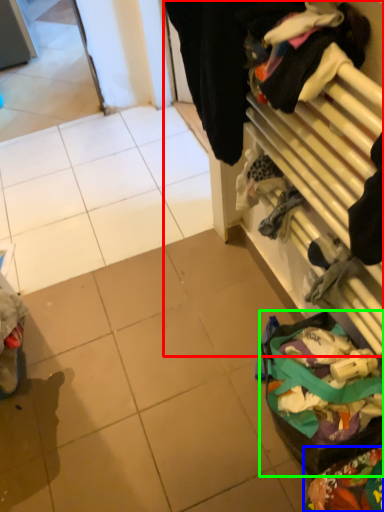
Question: Which object is positioned farthest from closet (highlighted by a red box)? Select from waste (highlighted by a blue box) and waste (highlighted by a green box).

Choices:
 (A) waste
 (B) waste

Answer: (A)